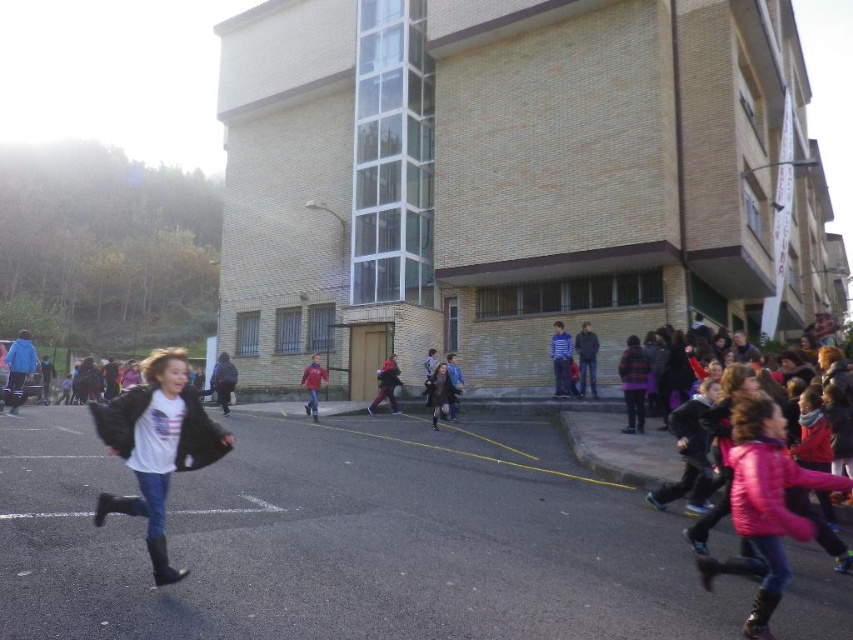
Question: Which point is farther to the camera?

Choices:
 (A) striped shirt at center
 (B) pink matte jacket at lower right

Answer: (A)

Question: Is black matte jacket at left smaller than matte red jacket at center?

Choices:
 (A) no
 (B) yes

Answer: (A)

Question: Does brick building at center have a lesser width compared to dark gray sweater at center?

Choices:
 (A) no
 (B) yes

Answer: (A)

Question: Estimate the real-world distances between objects in this image. Which object is farther from the black asphalt at lower left?

Choices:
 (A) matte black jacket at center
 (B) dark gray sweater at center

Answer: (A)

Question: Among these objects, which one is farthest from the camera?

Choices:
 (A) dark gray sweater at center
 (B) striped shirt at center
 (C) matte black jacket at center

Answer: (C)

Question: Does striped shirt at center come behind dark gray sweater at center?

Choices:
 (A) yes
 (B) no

Answer: (A)